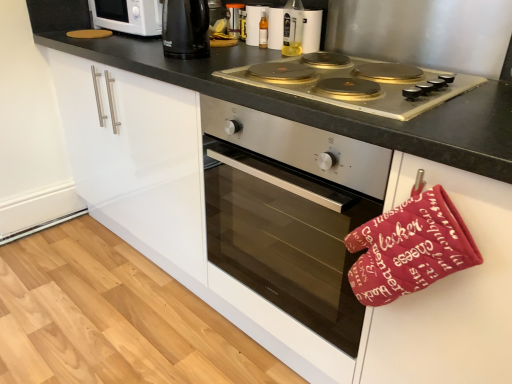
Locate an element on the screen. vacant area that is in front of black plastic kettle at upper center is located at coordinates (176, 66).